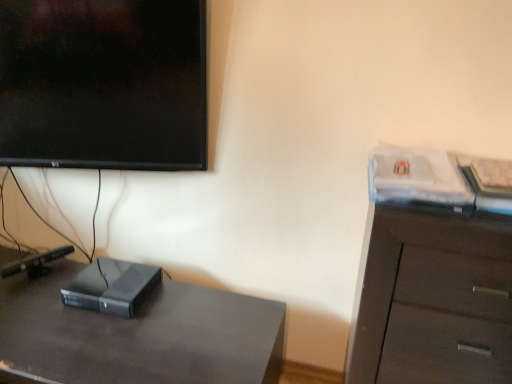
Find the location of `free spot above black matte computer at lower left (from a real-world perspective)`. free spot above black matte computer at lower left (from a real-world perspective) is located at coordinates (112, 276).